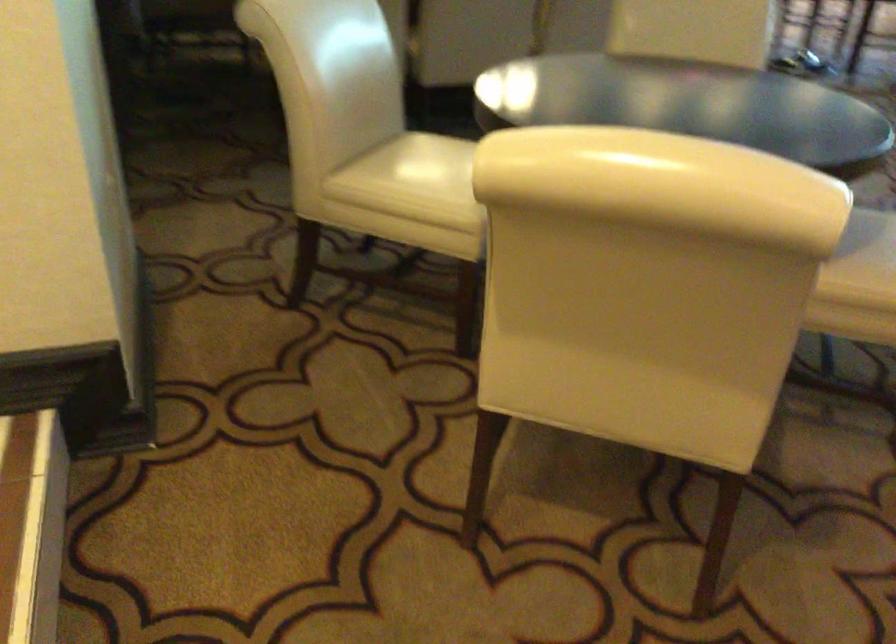
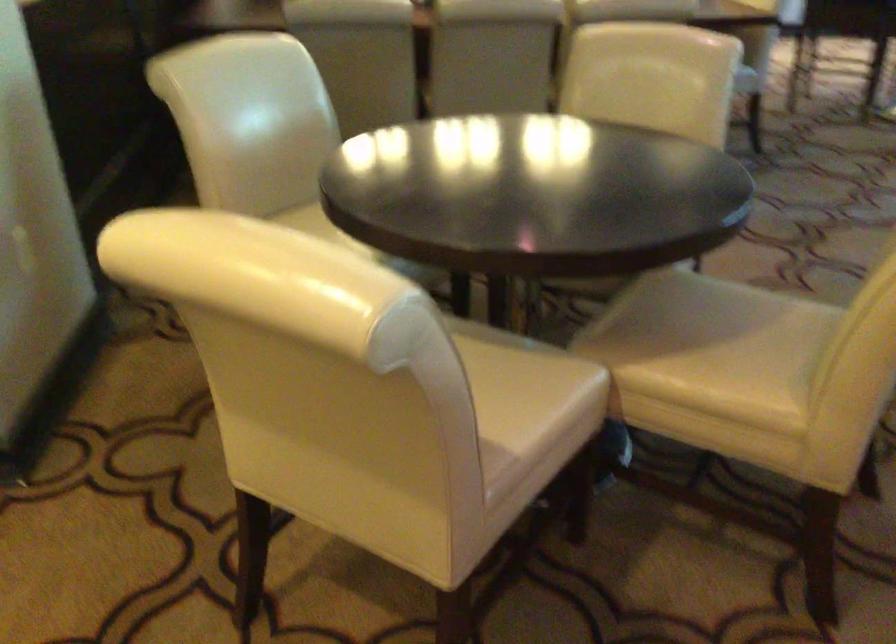
Question: The camera is either moving clockwise (left) or counter-clockwise (right) around the object. The first image is from the beginning of the video and the second image is from the end. Is the camera moving left or right when shooting the video?

Choices:
 (A) Left
 (B) Right

Answer: (B)